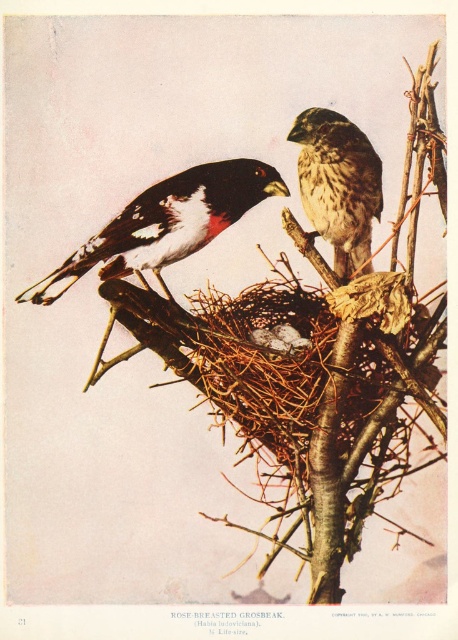
Looking at this image, you are a birdwatcher observing the two birds in the scene. You notice that the black and white speckled bird at center and the brown speckled feathers at upper center are both perched on the same branch. Which of these two birds is wider?

The black and white speckled bird at center is wider than the brown speckled feathers at upper center because its width surpasses the other bird.

You are a birdwatcher standing 5 feet away from a tree. You notice the brown twigs at center which form a nest. Can you safely reach out to touch the nest without disturbing the birds?

The brown twigs at center are 4.76 feet away from the viewer. Since you are standing 5 feet away from the tree, the distance to the nest is slightly less than your position, but attempting to touch it may still disturb the birds. It is advisable to observe from a safe distance.

You are a photographer holding a camera at a distance of 1.45 meters from the brown twigs at center. You want to capture a closeup shot of the twigs without moving your position. What adjustment should you make to your camera?

You should zoom in with your camera lens since you are 1.45 meters away from the brown twigs at center and cannot move closer.